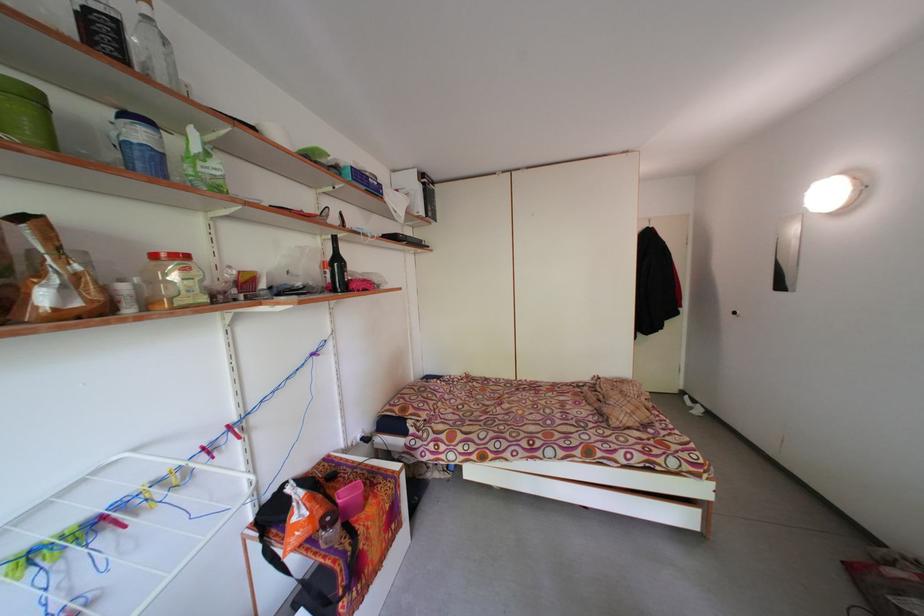
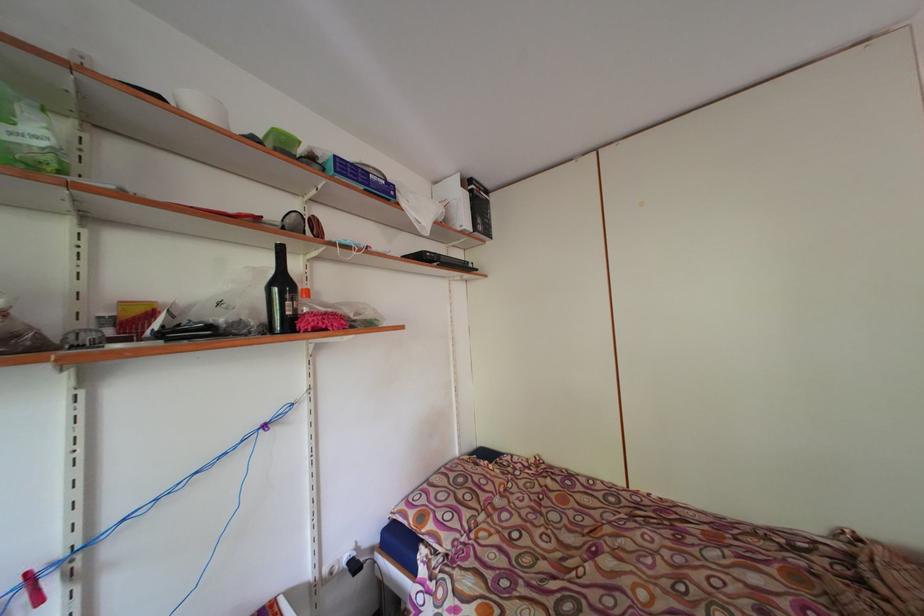
Find the pixel in the second image that matches (377,185) in the first image.

(377, 180)